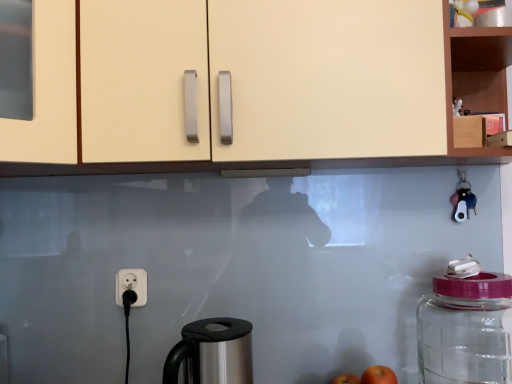
Question: From the image's perspective, is wooden cabinet at upper right, positioned as the first cabinetry in right-to-left order, above or below transparent glass jar at right?

Choices:
 (A) above
 (B) below

Answer: (A)

Question: In terms of width, does wooden cabinet at upper right, positioned as the first cabinetry in right-to-left order, look wider or thinner when compared to transparent glass jar at right?

Choices:
 (A) thin
 (B) wide

Answer: (B)

Question: Considering the real-world distances, which object is closest to the stainless steel coffee maker at lower center?

Choices:
 (A) red matte apple at lower right, the 2th apple viewed from the back
 (B) transparent glass jar at right
 (C) wooden cabinet at upper right, positioned as the first cabinetry in right-to-left order
 (D) red matte apple at lower right, acting as the 2th apple starting from the front
 (E) matte cream cabinet at upper center, which appears as the 1th cabinetry when viewed from the left

Answer: (A)

Question: Considering the real-world distances, which object is farthest from the stainless steel coffee maker at lower center?

Choices:
 (A) matte cream cabinet at upper center, which appears as the 1th cabinetry when viewed from the left
 (B) wooden cabinet at upper right, acting as the 2th cabinetry starting from the left
 (C) transparent glass jar at right
 (D) red matte apple at lower right, which is counted as the 2th apple, starting from the top
 (E) red matte apple at lower right, the 2th apple viewed from the back

Answer: (B)